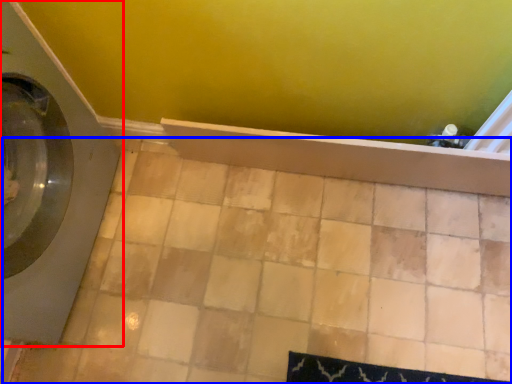
Question: Which point is closer to the camera, washing machine (highlighted by a red box) or ceramic tile (highlighted by a blue box)?

Choices:
 (A) washing machine
 (B) ceramic tile

Answer: (A)